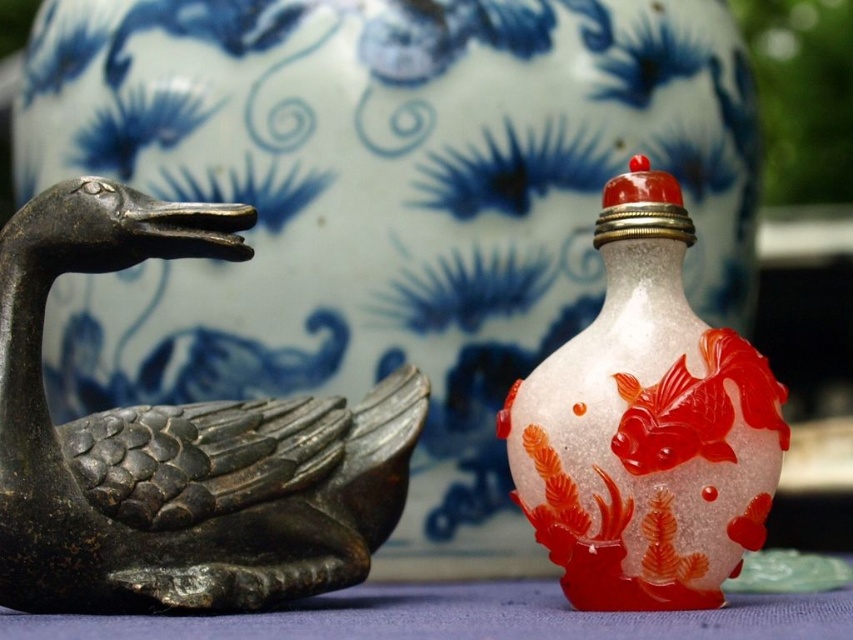
Question: Does black matte goose at left appear over translucent glass snuff bottle at center?

Choices:
 (A) yes
 (B) no

Answer: (B)

Question: Which point is closer to the camera taking this photo?

Choices:
 (A) (347, 506)
 (B) (614, 300)

Answer: (B)

Question: Does black matte goose at left have a lesser width compared to translucent glass snuff bottle at center?

Choices:
 (A) yes
 (B) no

Answer: (B)

Question: Considering the relative positions of black matte goose at left and translucent glass snuff bottle at center in the image provided, where is black matte goose at left located with respect to translucent glass snuff bottle at center?

Choices:
 (A) right
 (B) left

Answer: (B)

Question: Among these points, which one is farthest from the camera?

Choices:
 (A) (120, 608)
 (B) (608, 566)

Answer: (A)

Question: Which point appears closest to the camera in this image?

Choices:
 (A) (262, 488)
 (B) (676, 442)

Answer: (B)